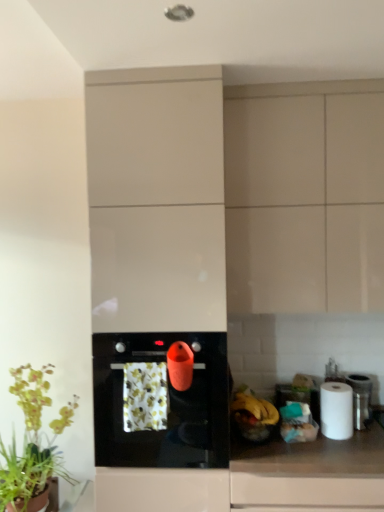
Find the location of a particular element. This screenshot has height=512, width=384. free space in front of white matte paper towel at right is located at coordinates (347, 446).